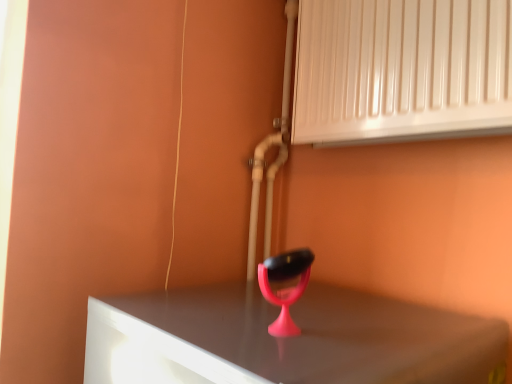
Question: Does point (271, 299) appear closer or farther from the camera than point (489, 82)?

Choices:
 (A) closer
 (B) farther

Answer: (A)

Question: Is pink plastic table lamp at center in front of or behind white glossy radiator at upper right in the image?

Choices:
 (A) front
 (B) behind

Answer: (A)

Question: In terms of size, does pink plastic table lamp at center appear bigger or smaller than white glossy radiator at upper right?

Choices:
 (A) small
 (B) big

Answer: (A)

Question: Relative to pink plastic table lamp at center, is white glossy radiator at upper right in front or behind?

Choices:
 (A) behind
 (B) front

Answer: (A)

Question: Considering the relative positions of white glossy radiator at upper right and pink plastic table lamp at center in the image provided, is white glossy radiator at upper right to the left or to the right of pink plastic table lamp at center?

Choices:
 (A) right
 (B) left

Answer: (A)

Question: Considering the positions of white glossy radiator at upper right and pink plastic table lamp at center in the image, is white glossy radiator at upper right wider or thinner than pink plastic table lamp at center?

Choices:
 (A) thin
 (B) wide

Answer: (B)

Question: Is white glossy radiator at upper right situated inside pink plastic table lamp at center or outside?

Choices:
 (A) inside
 (B) outside

Answer: (B)